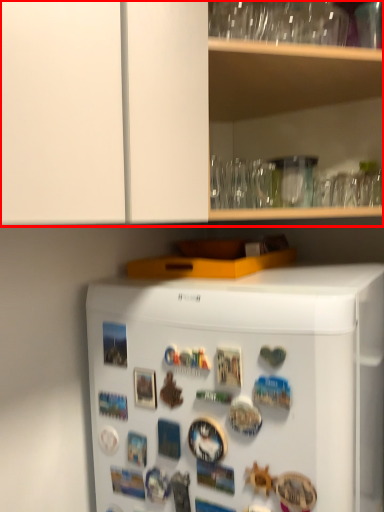
Question: From the image's perspective, what is the correct spatial positioning of cabinetry (annotated by the red box) in reference to refrigerator?

Choices:
 (A) below
 (B) above

Answer: (B)